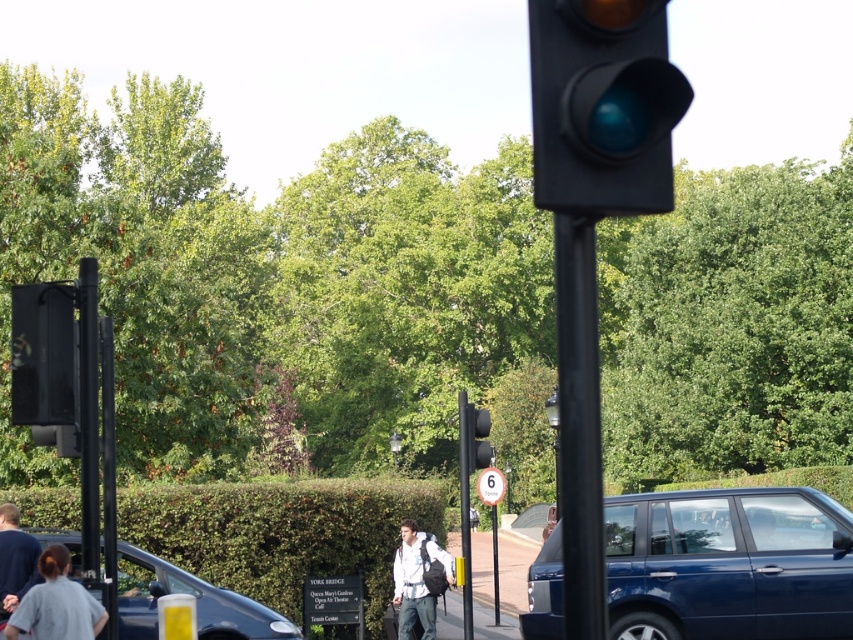
Is point (618, 150) closer to viewer compared to point (463, 445)?

Yes, it is in front of point (463, 445).

Which is behind, point (608, 138) or point (467, 406)?

The point (467, 406) is more distant.

Is point (665, 61) farther from camera compared to point (457, 410)?

No, (665, 61) is closer to viewer.

Identify the location of matte black traffic light at upper right. (602, 106).

Measure the distance between matte black traffic light at upper right and camera.

matte black traffic light at upper right and camera are 3.85 meters apart from each other.

Between point (535, 72) and point (410, 573), which one is positioned behind?

The point (410, 573) is more distant.

Which is in front, point (544, 35) or point (445, 580)?

Point (544, 35)

You are a GUI agent. You are given a task and a screenshot of the screen. Output one action in this format:
    pyautogui.click(x=<x>, y=<y>)
    Task: Click on the matte black traffic light at upper right
    
    Given the screenshot: What is the action you would take?
    pyautogui.click(x=602, y=106)

Between shiny blue suv at lower right and green leafy hedge at lower center, which one has less height?

Standing shorter between the two is shiny blue suv at lower right.

Is the position of shiny blue suv at lower right more distant than that of green leafy hedge at lower center?

That is False.

The image size is (853, 640). I want to click on shiny blue suv at lower right, so click(728, 564).